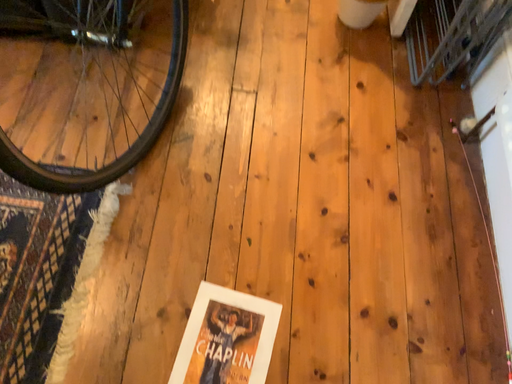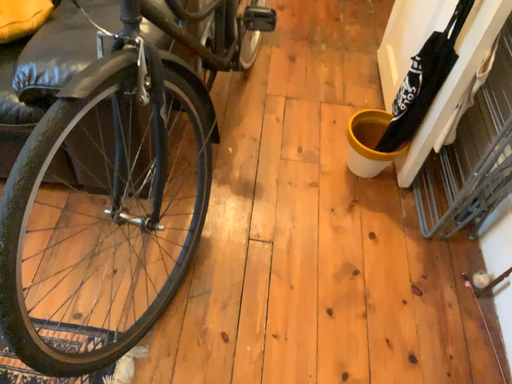
Question: How did the camera likely rotate when shooting the video?

Choices:
 (A) rotated downward
 (B) rotated upward

Answer: (B)